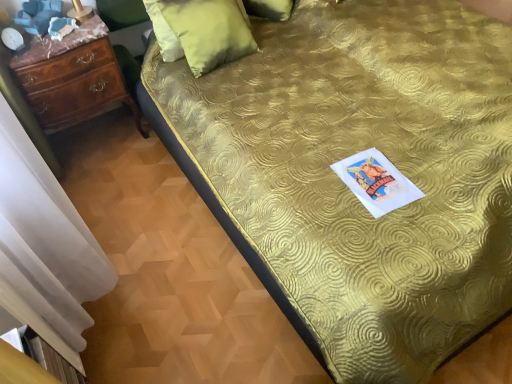
Question: Which direction should I rotate to face velvet green pillow at upper center, which is counted as the second pillow, starting from the back, — up or down?

Choices:
 (A) up
 (B) down

Answer: (A)

Question: Is gold textured bedspread at center further to camera compared to white sheer curtain at left?

Choices:
 (A) yes
 (B) no

Answer: (A)

Question: From the image's perspective, is gold textured bedspread at center below white sheer curtain at left?

Choices:
 (A) yes
 (B) no

Answer: (B)

Question: Is gold textured bedspread at center oriented away from white sheer curtain at left?

Choices:
 (A) no
 (B) yes

Answer: (A)

Question: Is gold textured bedspread at center oriented towards white sheer curtain at left?

Choices:
 (A) no
 (B) yes

Answer: (A)

Question: Is gold textured bedspread at center next to white sheer curtain at left and touching it?

Choices:
 (A) yes
 (B) no

Answer: (B)

Question: Does gold textured bedspread at center have a larger size compared to white sheer curtain at left?

Choices:
 (A) yes
 (B) no

Answer: (B)

Question: Is white sheer curtain at left next to gold textured bedspread at center?

Choices:
 (A) no
 (B) yes

Answer: (A)

Question: Would you say white sheer curtain at left contains gold textured bedspread at center?

Choices:
 (A) no
 (B) yes

Answer: (A)

Question: Can you confirm if white sheer curtain at left is wider than gold textured bedspread at center?

Choices:
 (A) yes
 (B) no

Answer: (B)

Question: Considering the relative positions of white sheer curtain at left and gold textured bedspread at center in the image provided, is white sheer curtain at left behind gold textured bedspread at center?

Choices:
 (A) no
 (B) yes

Answer: (A)

Question: Is white sheer curtain at left far from gold textured bedspread at center?

Choices:
 (A) no
 (B) yes

Answer: (A)

Question: From the image's perspective, is white sheer curtain at left beneath gold textured bedspread at center?

Choices:
 (A) yes
 (B) no

Answer: (A)

Question: Could you tell me if mahogany wood chest of drawers at left is turned towards gold textured bedspread at center?

Choices:
 (A) yes
 (B) no

Answer: (B)